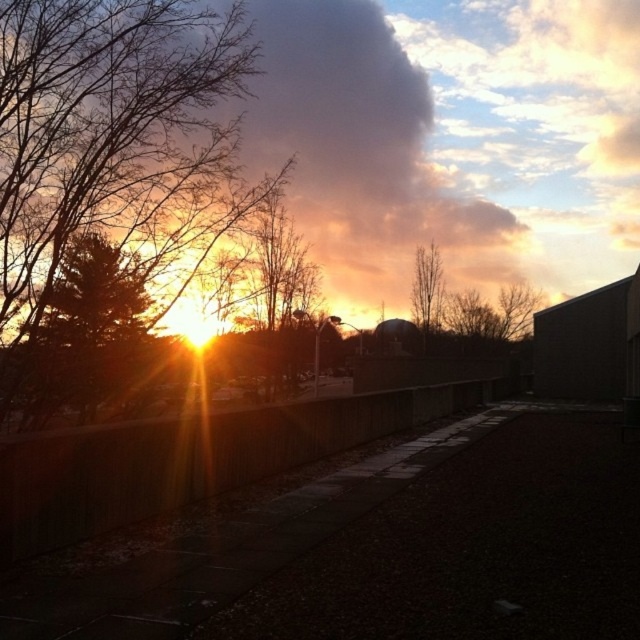
Can you confirm if orange-brown bark tree at center is positioned above bare wood tree at upper center?

No, orange-brown bark tree at center is not above bare wood tree at upper center.

Between point (284, 364) and point (438, 276), which one is positioned behind?

The point (438, 276) is more distant.

Find the location of a particular element. Image resolution: width=640 pixels, height=640 pixels. orange-brown bark tree at center is located at coordinates (275, 305).

Is brown leafless branches at left wider than orange-brown bark tree at center?

No.

Between point (24, 364) and point (272, 317), which one is positioned in front?

Positioned in front is point (24, 364).

The image size is (640, 640). I want to click on brown leafless branches at left, so click(x=102, y=140).

Image resolution: width=640 pixels, height=640 pixels. What are the coordinates of `brown leafless branches at left` in the screenshot? It's located at (102, 140).

Who is more distant from viewer, (147, 24) or (432, 291)?

The point (432, 291) is more distant.

Is brown leafless branches at left shorter than bare wood tree at upper center?

Indeed, brown leafless branches at left has a lesser height compared to bare wood tree at upper center.

Which is behind, point (3, 278) or point (410, 289)?

The point (410, 289) is behind.

Locate an element on the screen. The image size is (640, 640). brown leafless branches at left is located at coordinates 102,140.